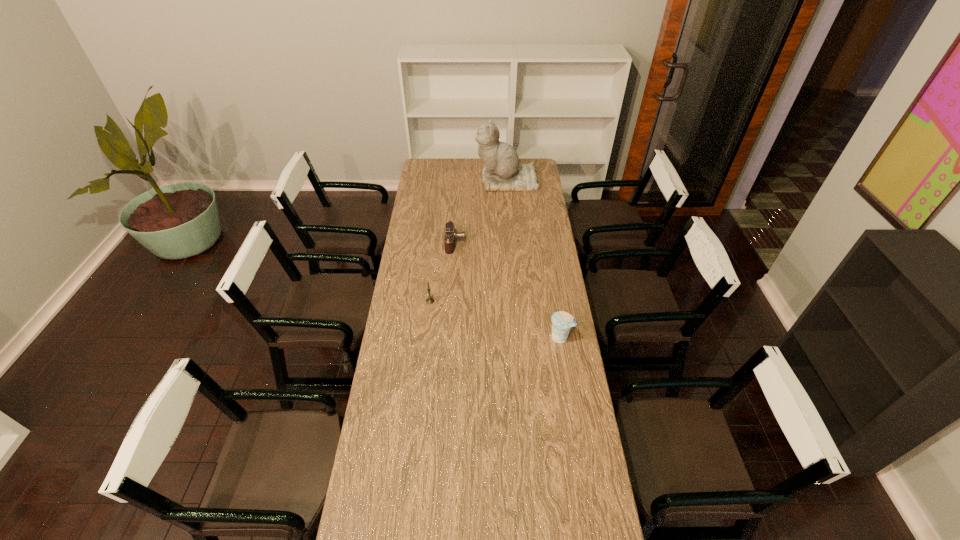
Where is `free space at the right edge of the desktop`? free space at the right edge of the desktop is located at coordinates (567, 423).

Identify the location of free space between the nearest object and the tallest object. The width and height of the screenshot is (960, 540). (534, 259).

The image size is (960, 540). What are the coordinates of `empty location between the farthest object and the camera` in the screenshot? It's located at (481, 212).

At what (x,y) coordinates should I click in order to perform the action: click on free space between the yogurt and the leftmost object. Please return your answer as a coordinate pair (x, y). Looking at the image, I should click on (495, 319).

Find the location of `free space between the shortest object and the cat`. free space between the shortest object and the cat is located at coordinates (481, 212).

Where is `free spot between the cat and the nearest object`? free spot between the cat and the nearest object is located at coordinates (534, 259).

Image resolution: width=960 pixels, height=540 pixels. Find the location of `vacant space that's between the tallest object and the second farthest object`. vacant space that's between the tallest object and the second farthest object is located at coordinates (481, 212).

This screenshot has height=540, width=960. What are the coordinates of `free space between the shortest object and the leftmost object` in the screenshot? It's located at (443, 272).

Locate an element on the screen. The image size is (960, 540). object that is the third closest to the cat is located at coordinates (562, 322).

Choose which object is the third nearest neighbor to the yogurt. Please provide its 2D coordinates. Your answer should be formatted as a tuple, i.e. [(x, y)], where the tuple contains the x and y coordinates of a point satisfying the conditions above.

[(502, 171)]